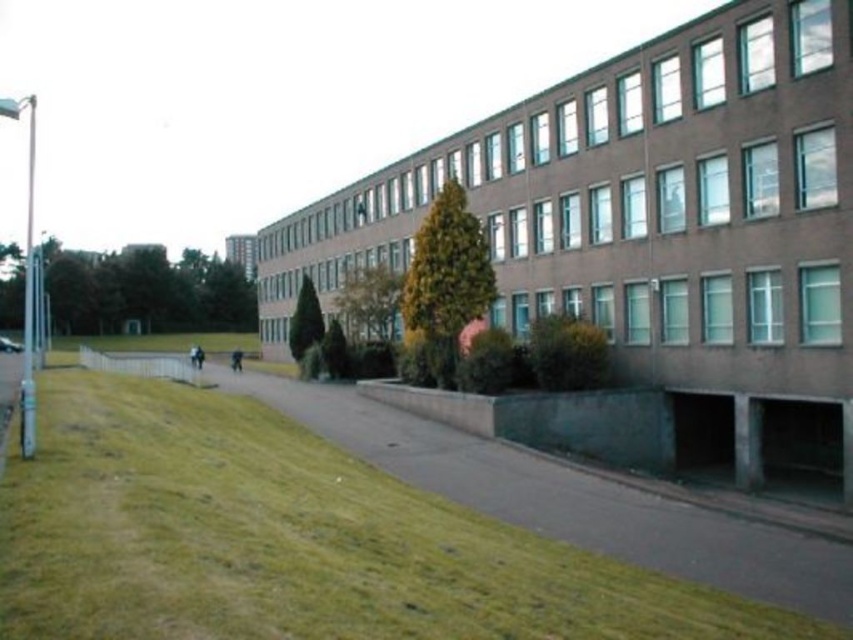
Question: Which of the following is the closest to the observer?

Choices:
 (A) (206, 388)
 (B) (173, 349)

Answer: (A)

Question: Can you confirm if green grass at lower left is wider than green grass at center?

Choices:
 (A) no
 (B) yes

Answer: (A)

Question: Is green grass at lower left above green grass at center?

Choices:
 (A) no
 (B) yes

Answer: (A)

Question: Does green grass at lower left appear on the right side of green grass at center?

Choices:
 (A) yes
 (B) no

Answer: (A)